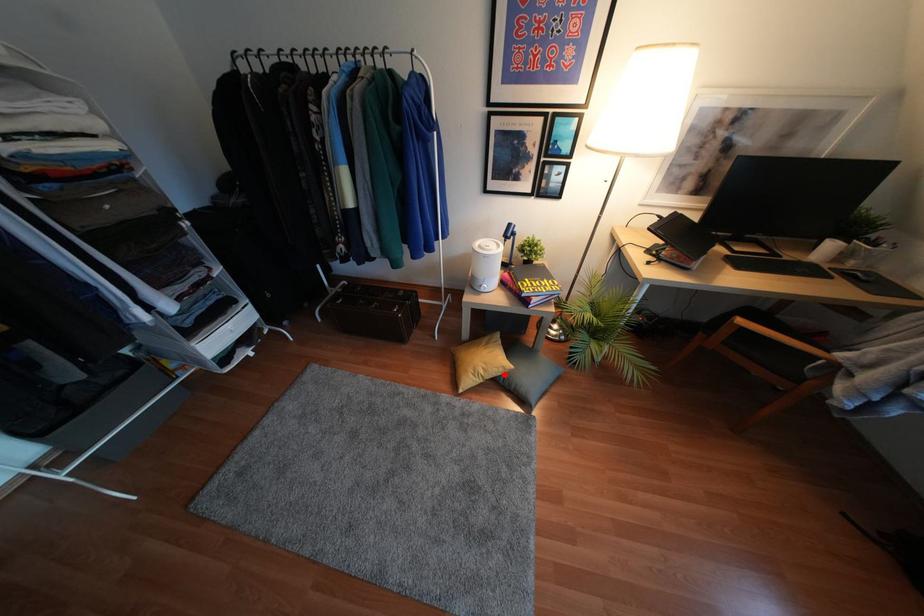
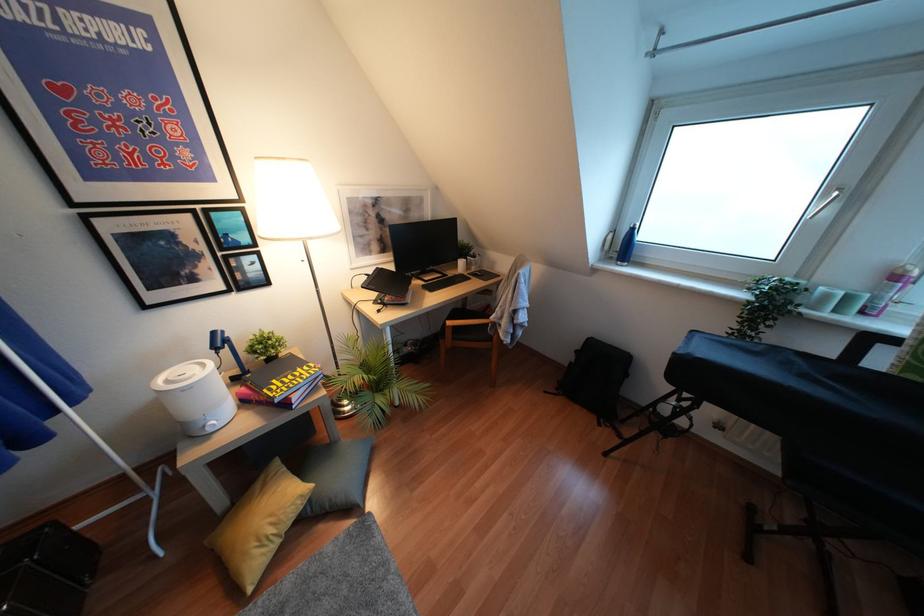
Find the pixel in the second image that matches the highlighted location in the first image.

(310, 500)